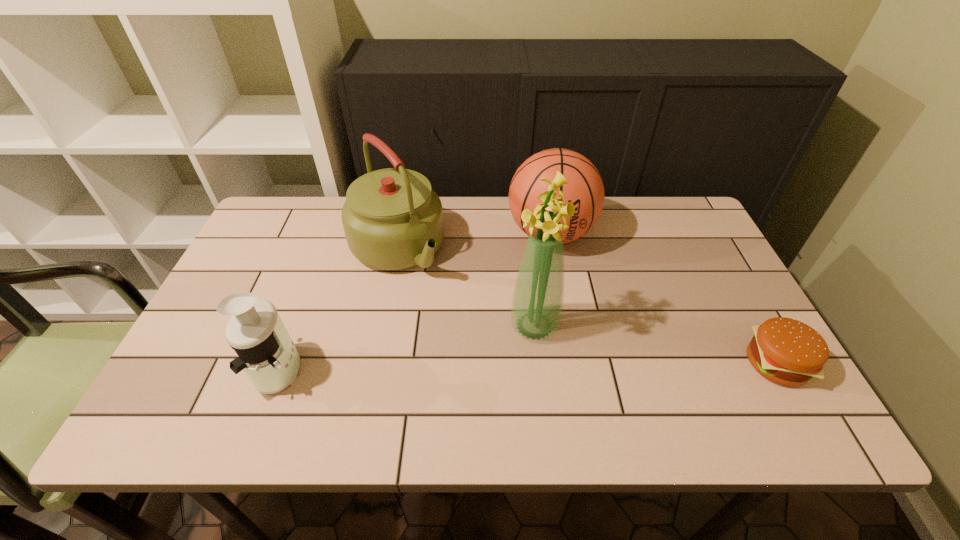
Where is `blank area located 0.110m on the surface of the basketball near the brand logo`? blank area located 0.110m on the surface of the basketball near the brand logo is located at coordinates (553, 292).

Locate an element on the screen. The width and height of the screenshot is (960, 540). vacant space located on the surface of the basketball near the brand logo is located at coordinates (556, 348).

The height and width of the screenshot is (540, 960). Find the location of `free space located on the front-facing side of the bouquet`. free space located on the front-facing side of the bouquet is located at coordinates (430, 390).

This screenshot has height=540, width=960. What are the coordinates of `free space located on the front-facing side of the bouquet` in the screenshot? It's located at tap(479, 360).

Find the location of a particular element. The image size is (960, 540). vacant space situated on the front-facing side of the bouquet is located at coordinates 499,347.

The width and height of the screenshot is (960, 540). I want to click on free space located 0.230m at the spout of the second tallest object, so pos(470,335).

Where is `free location located at the spout of the second tallest object`? free location located at the spout of the second tallest object is located at coordinates pyautogui.click(x=433, y=293).

Where is `vacant space located at the spout of the second tallest object`? The height and width of the screenshot is (540, 960). vacant space located at the spout of the second tallest object is located at coordinates (498, 367).

Find the location of a particular element. Image resolution: width=960 pixels, height=540 pixels. basketball present at the far edge is located at coordinates (585, 189).

Image resolution: width=960 pixels, height=540 pixels. What are the coordinates of `kettle that is at the far edge` in the screenshot? It's located at (392, 218).